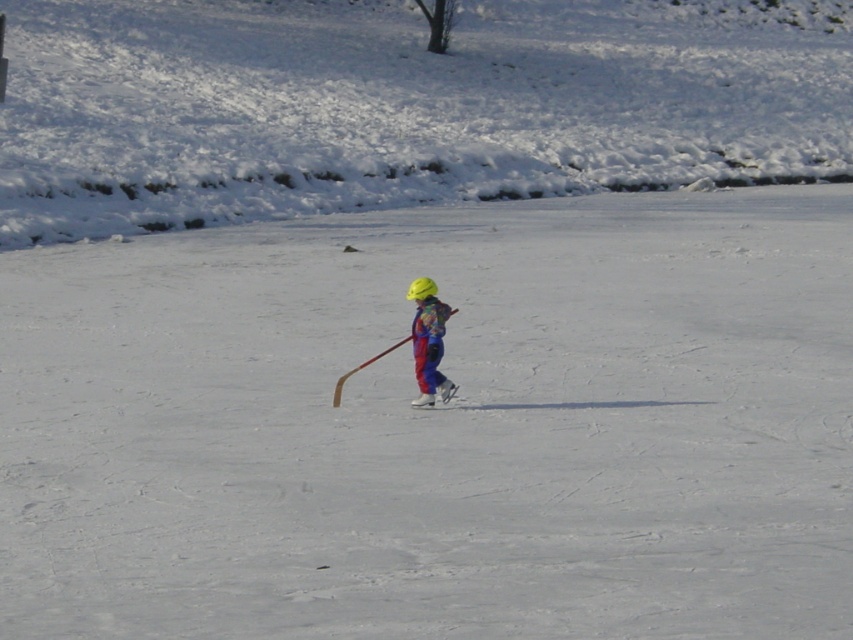
Question: Is multicolored fabric child at center thinner than white matte ski at center?

Choices:
 (A) no
 (B) yes

Answer: (B)

Question: Does multicolored fabric child at center have a larger size compared to white matte ski at center?

Choices:
 (A) no
 (B) yes

Answer: (B)

Question: Can you confirm if multicolored fabric child at center is positioned to the left of white matte ski at center?

Choices:
 (A) no
 (B) yes

Answer: (B)

Question: Among these objects, which one is farthest from the camera?

Choices:
 (A) multicolored fabric child at center
 (B) white matte ski at center

Answer: (B)

Question: Which point appears closest to the camera in this image?

Choices:
 (A) (445, 401)
 (B) (421, 316)

Answer: (B)